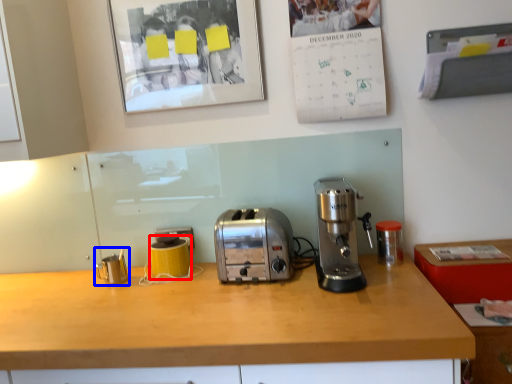
Question: Which point is closer to the camera, appliance (highlighted by a red box) or appliance (highlighted by a blue box)?

Choices:
 (A) appliance
 (B) appliance

Answer: (B)